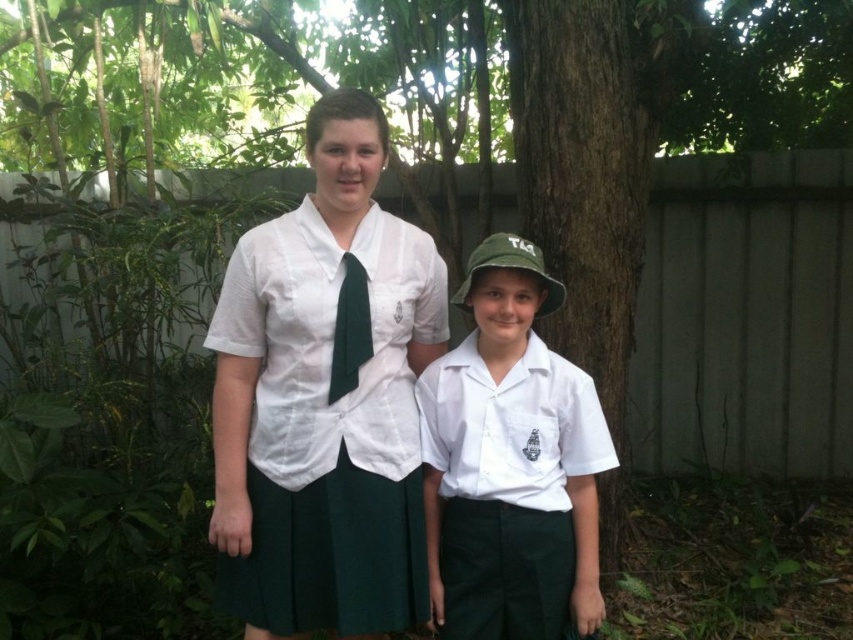
Question: From the image, what is the correct spatial relationship of matte white blouse at center in relation to white fabric shirt at center?

Choices:
 (A) right
 (B) left

Answer: (B)

Question: Is matte white blouse at center positioned behind green silk tie at center?

Choices:
 (A) yes
 (B) no

Answer: (B)

Question: Which point is farther to the camera?

Choices:
 (A) matte white blouse at center
 (B) white fabric shirt at center
 (C) green silk tie at center

Answer: (C)

Question: Which of the following is the farthest from the observer?

Choices:
 (A) (390, 573)
 (B) (358, 353)

Answer: (A)

Question: Can you confirm if matte white blouse at center is positioned above green silk tie at center?

Choices:
 (A) yes
 (B) no

Answer: (B)

Question: Which point is farther from the camera taking this photo?

Choices:
 (A) (370, 332)
 (B) (339, 593)
 (C) (532, 410)

Answer: (C)